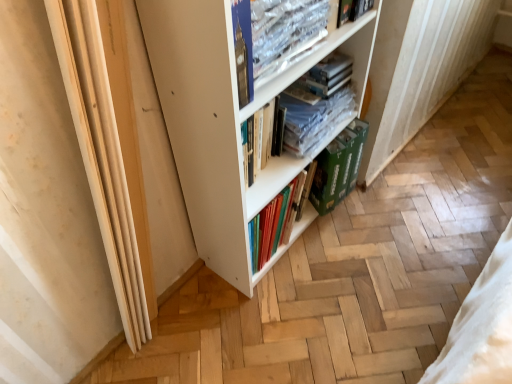
Question: Is green cardboard box at lower center taller or shorter than clear plastic book at upper center, acting as the 3th book starting from the back?

Choices:
 (A) tall
 (B) short

Answer: (A)

Question: Is point (310, 193) positioned closer to the camera than point (323, 1)?

Choices:
 (A) closer
 (B) farther

Answer: (B)

Question: Based on their relative distances, which object is nearer to the clear plastic books at center, the 3th book from the front?

Choices:
 (A) green cardboard box at lower center
 (B) hardcover book at upper center, positioned as the 2th book in back-to-front order
 (C) clear plastic book at upper center, acting as the 3th book starting from the back
 (D) white matte bookcase at center

Answer: (D)

Question: Considering the real-world distances, which object is farthest from the clear plastic book at upper center, acting as the 3th book starting from the back?

Choices:
 (A) green cardboard box at lower center
 (B) clear plastic books at center, the 3th book from the front
 (C) white matte bookcase at center
 (D) hardcover book at upper center, marked as the 2th book in a front-to-back arrangement

Answer: (A)